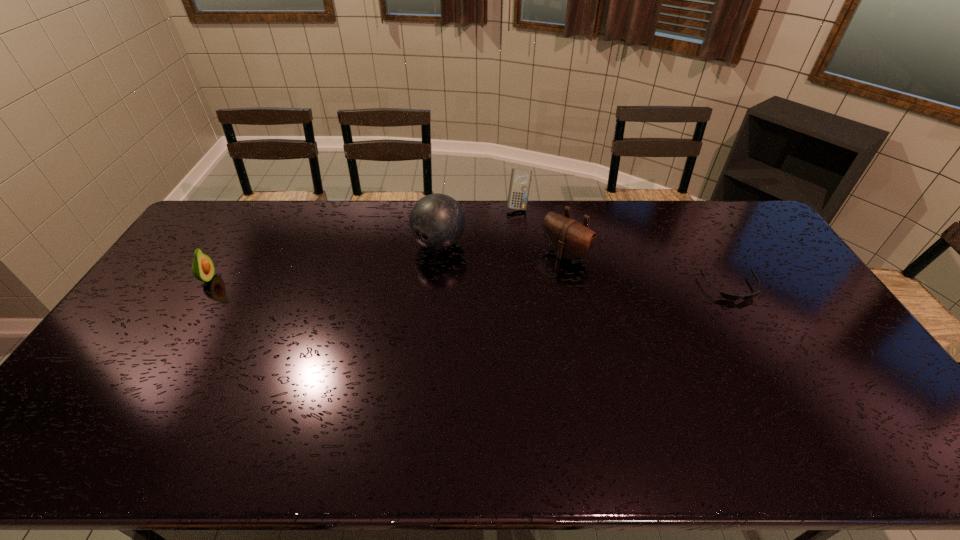
Locate an element on the screen. This screenshot has width=960, height=540. vacant area between the fourth tallest object and the calculator is located at coordinates (363, 242).

This screenshot has height=540, width=960. In order to click on vacant region between the second object from left to right and the farthest object in this screenshot , I will do `click(479, 225)`.

Where is `vacant region between the pouch and the farthest object`? This screenshot has height=540, width=960. vacant region between the pouch and the farthest object is located at coordinates (541, 230).

Image resolution: width=960 pixels, height=540 pixels. I want to click on vacant point located between the shortest object and the fourth object from right to left, so click(x=585, y=266).

At what (x,y) coordinates should I click in order to perform the action: click on free area in between the rightmost object and the third object from right to left. Please return your answer as a coordinate pair (x, y). Looking at the image, I should click on (625, 247).

Find the location of a particular element. This screenshot has width=960, height=540. free space between the avocado and the calculator is located at coordinates (363, 242).

At what (x,y) coordinates should I click in order to perform the action: click on free space between the pouch and the rightmost object. Please return your answer as a coordinate pair (x, y). Looking at the image, I should click on (648, 271).

The image size is (960, 540). I want to click on vacant space in between the tallest object and the farthest object, so click(x=479, y=225).

Locate an element on the screen. This screenshot has width=960, height=540. vacant area that lies between the second shortest object and the shortest object is located at coordinates (469, 284).

What are the coordinates of `the second closest object to the rightmost object` in the screenshot? It's located at (520, 180).